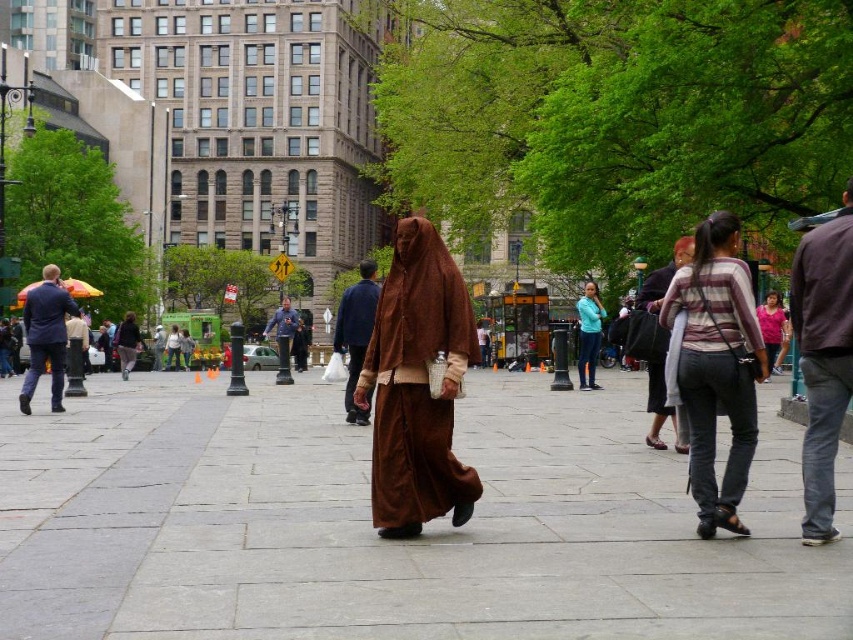
You are a photographer trying to capture the brown velvet robe at center without including the gray stone pavement at center in the frame. Is this possible given their positions?

The gray stone pavement at center is below the brown velvet robe at center, so it is possible to frame the photo such that the brown velvet robe at center is captured without the gray stone pavement at center appearing in the shot.